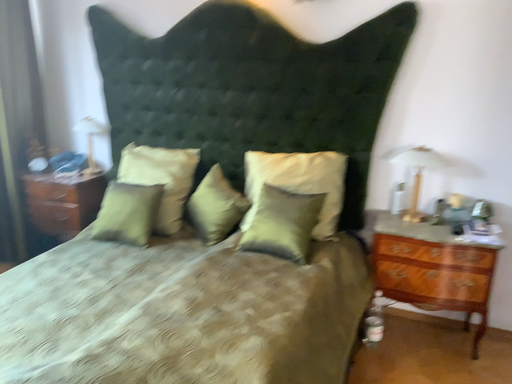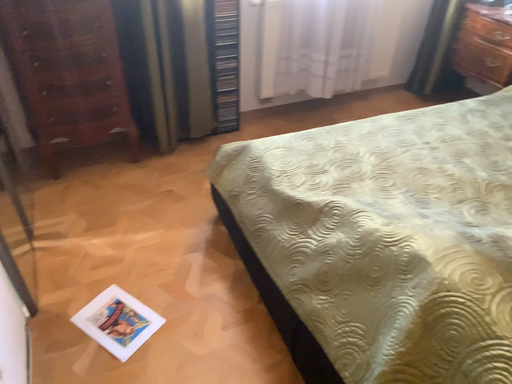
Question: Which way did the camera rotate in the video?

Choices:
 (A) rotated upward
 (B) rotated downward

Answer: (B)